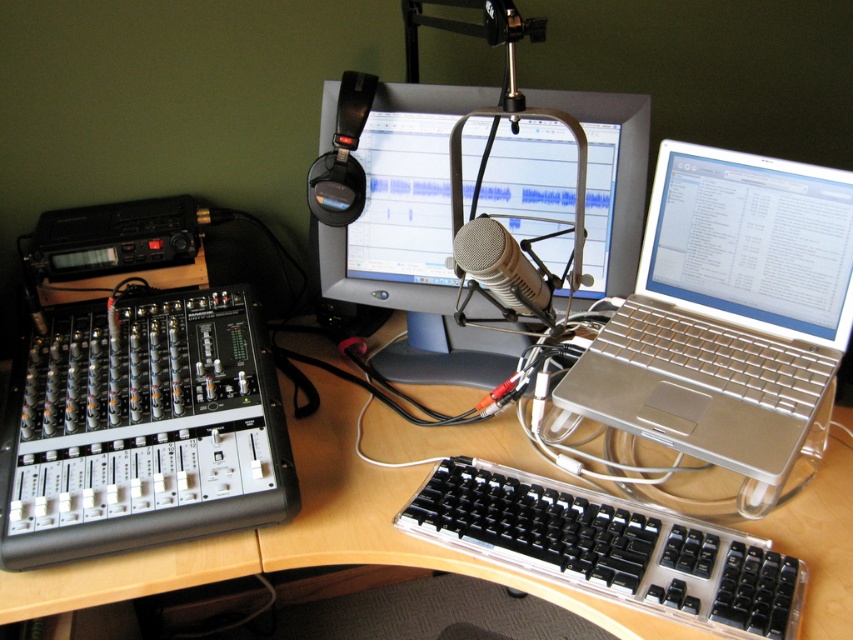
Is silver metallic laptop at center thinner than silver metallic microphone at center?

In fact, silver metallic laptop at center might be wider than silver metallic microphone at center.

Can you confirm if silver metallic laptop at center is taller than silver metallic microphone at center?

Correct, silver metallic laptop at center is much taller as silver metallic microphone at center.

Does point (643, 161) come closer to viewer compared to point (514, 268)?

No, (643, 161) is further to viewer.

Image resolution: width=853 pixels, height=640 pixels. What are the coordinates of `silver metallic laptop at center` in the screenshot? It's located at (413, 241).

Is point (792, 424) less distant than point (500, 230)?

No, it is behind (500, 230).

Between point (788, 266) and point (506, 301), which one is positioned in front?

Point (506, 301) is in front.

The width and height of the screenshot is (853, 640). I want to click on silver metallic laptop at right, so click(x=727, y=310).

Find the location of a particular element. silver metallic laptop at right is located at coordinates (727, 310).

Does silver metallic laptop at right have a greater height compared to clear plastic keyboard at center?

Indeed, silver metallic laptop at right has a greater height compared to clear plastic keyboard at center.

Does silver metallic laptop at right appear on the right side of clear plastic keyboard at center?

Indeed, silver metallic laptop at right is positioned on the right side of clear plastic keyboard at center.

Find the location of `silver metallic laptop at right`. silver metallic laptop at right is located at coordinates (727, 310).